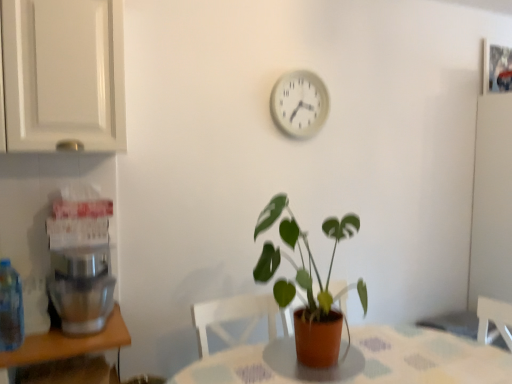
I want to click on translucent plastic bottle at left, so click(10, 307).

Identify the location of metallic silver coffee machine at left. [x=81, y=286].

Describe the element at coordinates (81, 286) in the screenshot. I see `metallic silver coffee machine at left` at that location.

In order to click on translucent plastic bottle at left in this screenshot , I will do `click(10, 307)`.

Is patterned fabric table at center spatially inside white plastic clock at upper center, or outside of it?

The correct answer is: outside.

From a real-world perspective, relative to white plastic clock at upper center, is patterned fabric table at center vertically above or below?

patterned fabric table at center is situated lower than white plastic clock at upper center in the real world.

Is patterned fabric table at center wider or thinner than white plastic clock at upper center?

Clearly, patterned fabric table at center has more width compared to white plastic clock at upper center.

Which object is further away from the camera taking this photo, patterned fabric table at center or white plastic clock at upper center?

Positioned behind is white plastic clock at upper center.

Which point is more forward, (278,299) or (111,295)?

Positioned in front is point (278,299).

I want to click on houseplant located in front of the metallic silver coffee machine at left, so [x=311, y=286].

Which of these two, green matte plant at center or metallic silver coffee machine at left, is thinner?

→ Thinner between the two is metallic silver coffee machine at left.

Does metallic silver coffee machine at left have a lesser height compared to translucent plastic bottle at left?

Yes.

Is metallic silver coffee machine at left beside translucent plastic bottle at left?

No, metallic silver coffee machine at left is not in contact with translucent plastic bottle at left.

Does green matte plant at center have a larger size compared to white glossy cabinet at upper left?

Indeed, green matte plant at center has a larger size compared to white glossy cabinet at upper left.

From a real-world perspective, is green matte plant at center physically below white glossy cabinet at upper left?

Yes.

Locate an element on the screen. cabinetry above the green matte plant at center (from a real-world perspective) is located at coordinates (64, 75).

Between point (507, 354) and point (75, 284), which one is positioned in front?

The point (75, 284) is in front.

From the image's perspective, relative to metallic silver coffee machine at left, is patterned fabric table at center above or below?

Based on their image positions, patterned fabric table at center is located beneath metallic silver coffee machine at left.

From a real-world perspective, is patterned fabric table at center above or below metallic silver coffee machine at left?

patterned fabric table at center is situated lower than metallic silver coffee machine at left in the real world.

Considering the positions of objects patterned fabric table at center and metallic silver coffee machine at left in the image provided, who is behind, patterned fabric table at center or metallic silver coffee machine at left?

metallic silver coffee machine at left is behind.

Does green matte plant at center have a larger size compared to translucent plastic bottle at left?

Indeed, green matte plant at center has a larger size compared to translucent plastic bottle at left.

Is green matte plant at center turned away from translucent plastic bottle at left?

That's not correct — green matte plant at center is not looking away from translucent plastic bottle at left.

Does green matte plant at center have a greater height compared to translucent plastic bottle at left?

Yes, green matte plant at center is taller than translucent plastic bottle at left.

Which object is positioned more to the left, green matte plant at center or translucent plastic bottle at left?

Positioned to the left is translucent plastic bottle at left.

Is white plastic clock at upper center oriented towards white glossy cabinet at upper left?

No, white plastic clock at upper center does not turn towards white glossy cabinet at upper left.

From a real-world perspective, does white plastic clock at upper center stand above white glossy cabinet at upper left?

No, from a real-world perspective, white plastic clock at upper center is not above white glossy cabinet at upper left.

In the scene shown: From the image's perspective, is white plastic clock at upper center located beneath white glossy cabinet at upper left?

No, from the image's perspective, white plastic clock at upper center is not below white glossy cabinet at upper left.

Looking at the image, does white plastic clock at upper center seem bigger or smaller compared to white glossy cabinet at upper left?

In the image, white plastic clock at upper center appears to be smaller than white glossy cabinet at upper left.

Where is `clock on the left of patterned fabric table at center`? Image resolution: width=512 pixels, height=384 pixels. clock on the left of patterned fabric table at center is located at coordinates (298, 104).

Find the location of a particular element. The height and width of the screenshot is (384, 512). coffee machine located behind the green matte plant at center is located at coordinates (81, 286).

Considering their positions, is green matte plant at center positioned closer to metallic silver coffee machine at left than translucent plastic bottle at left?

Based on the image, translucent plastic bottle at left appears to be nearer to metallic silver coffee machine at left.

Based on their spatial positions, is metallic silver coffee machine at left or white plastic clock at upper center closer to green matte plant at center?

Based on the image, white plastic clock at upper center appears to be nearer to green matte plant at center.

From the image, which object appears to be nearer to patterned fabric table at center, green matte plant at center or white glossy cabinet at upper left?

green matte plant at center.

When comparing their distances from patterned fabric table at center, does green matte plant at center or metallic silver coffee machine at left seem further?

Based on the image, metallic silver coffee machine at left appears to be further to patterned fabric table at center.

Consider the image. From the image, which object appears to be farther from white plastic clock at upper center, patterned fabric table at center or metallic silver coffee machine at left?

metallic silver coffee machine at left.

Looking at the image, which one is located closer to metallic silver coffee machine at left, green matte plant at center or patterned fabric table at center?

patterned fabric table at center is positioned closer to the anchor metallic silver coffee machine at left.

Considering their positions, is white glossy cabinet at upper left positioned further to white plastic clock at upper center than metallic silver coffee machine at left?

metallic silver coffee machine at left lies further to white plastic clock at upper center than the other object.

From the picture: From the image, which object appears to be nearer to patterned fabric table at center, green matte plant at center or translucent plastic bottle at left?

green matte plant at center.

Find the location of a particular element. This screenshot has height=384, width=512. coffee machine between white glossy cabinet at upper left and white plastic clock at upper center in the horizontal direction is located at coordinates (81, 286).

Where is `houseplant that lies between white plastic clock at upper center and patterned fabric table at center from top to bottom`? The image size is (512, 384). houseplant that lies between white plastic clock at upper center and patterned fabric table at center from top to bottom is located at coordinates (311, 286).

You are a GUI agent. You are given a task and a screenshot of the screen. Output one action in this format:
    pyautogui.click(x=<x>, y=<y>)
    Task: Click on the cabinetry that lies between white plastic clock at upper center and patterned fabric table at center from top to bottom
    
    Given the screenshot: What is the action you would take?
    pyautogui.click(x=64, y=75)

You are a GUI agent. You are given a task and a screenshot of the screen. Output one action in this format:
    pyautogui.click(x=<x>, y=<y>)
    Task: Click on the coffee machine between white plastic clock at upper center and patterned fabric table at center in the up-down direction
    This screenshot has height=384, width=512.
    Given the screenshot: What is the action you would take?
    pos(81,286)